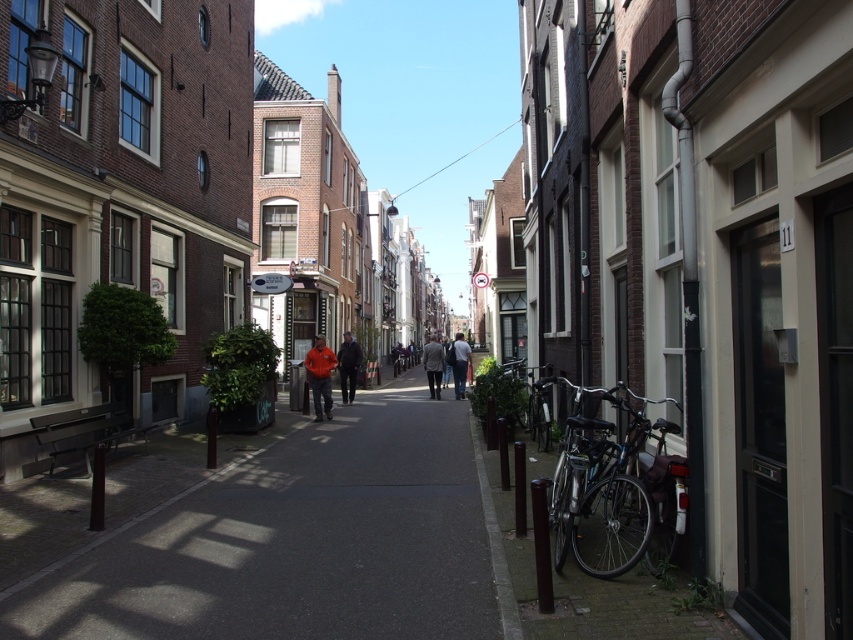
What do you see at coordinates (347, 365) in the screenshot? I see `dark blue jacket at center` at bounding box center [347, 365].

Can you confirm if dark blue jacket at center is smaller than orange jacket at center?

Yes.

Image resolution: width=853 pixels, height=640 pixels. Describe the element at coordinates (347, 365) in the screenshot. I see `dark blue jacket at center` at that location.

Identify the location of dark blue jacket at center. coord(347,365).

Does point (340, 436) come closer to viewer compared to point (308, 369)?

Yes, point (340, 436) is closer to viewer.

Does smooth asphalt pavement at center appear on the left side of orange fleece jacket at center?

No, smooth asphalt pavement at center is not to the left of orange fleece jacket at center.

Does point (380, 605) lie behind point (315, 360)?

That is False.

What are the coordinates of `smooth asphalt pavement at center` in the screenshot? It's located at (299, 544).

Does orange fleece jacket at center appear under orange jacket at center?

No, orange fleece jacket at center is not below orange jacket at center.

Who is more distant from viewer, (325, 388) or (465, 369)?

Positioned behind is point (465, 369).

Identify the location of orange fleece jacket at center. This screenshot has height=640, width=853. (320, 376).